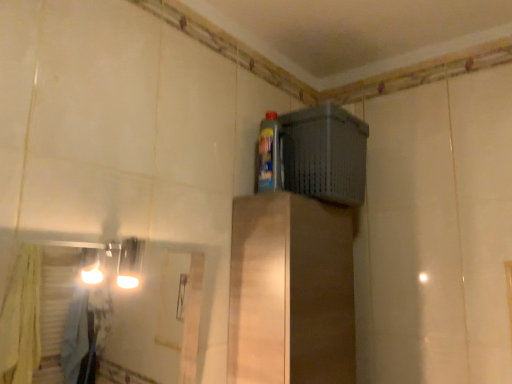
The width and height of the screenshot is (512, 384). Describe the element at coordinates (324, 154) in the screenshot. I see `gray plastic basket at upper right` at that location.

Locate an element on the screen. gray plastic basket at upper right is located at coordinates (324, 154).

Where is `gray plastic basket at upper right`? The image size is (512, 384). gray plastic basket at upper right is located at coordinates (324, 154).